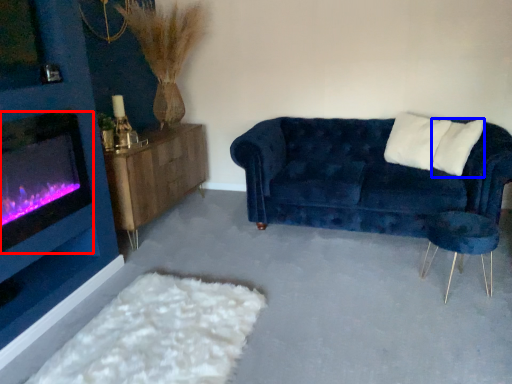
Question: Among these objects, which one is nearest to the camera, wood burning stove (highlighted by a red box) or pillow (highlighted by a blue box)?

Choices:
 (A) wood burning stove
 (B) pillow

Answer: (A)